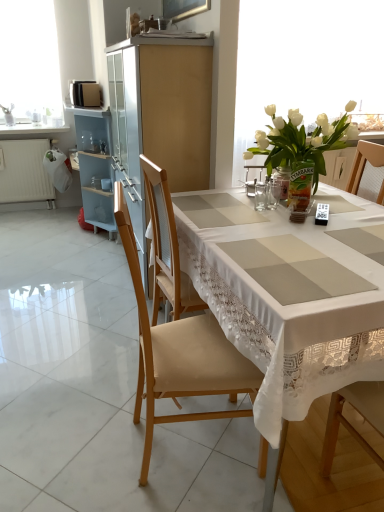
Find the location of `vacant space that is to the left of wooden chair at center, marked as the first chair in a front-to-back arrangement`. vacant space that is to the left of wooden chair at center, marked as the first chair in a front-to-back arrangement is located at coordinates (84, 435).